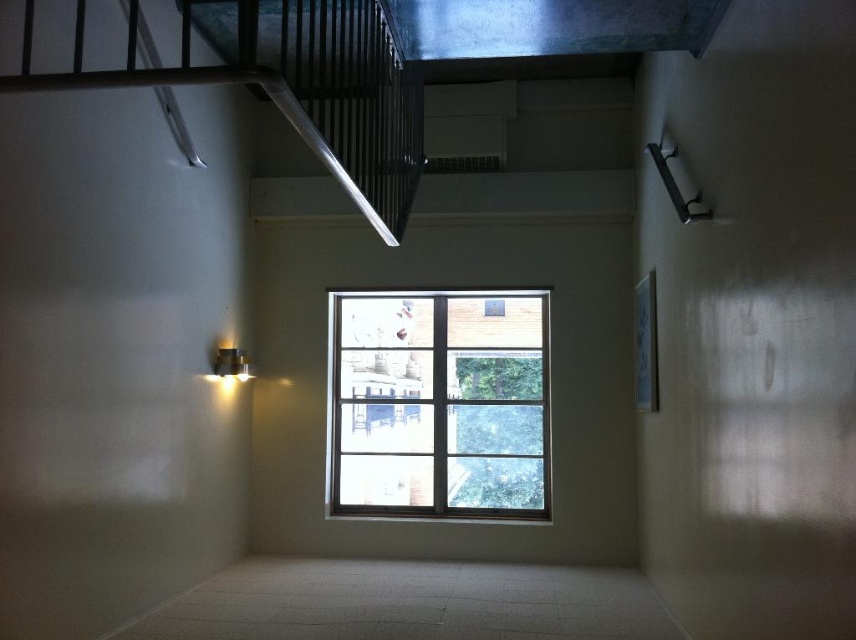
You are an interior designer planning to install a new piece of furniture in the room. You have a choice between placing a large sofa in front of the clear glass window at center or near the metallic silver stair at upper left. Based on the space each occupies, which location would you choose for the sofa to ensure it fits better?

The metallic silver stair at upper left occupies more space than the clear glass window at center, so placing the sofa near the metallic silver stair at upper left would provide more space for the sofa to fit better.

You are standing in the room and want to locate the metallic silver stair at upper left. According to the coordinates provided, where should you look?

You should look at point (327, 88) to locate the metallic silver stair at upper left.

You are standing in the room and want to turn on the matte silver light fixture at left. Can you reach it without moving the clear glass window at center?

The matte silver light fixture at left is behind the clear glass window at center, so you can reach it without moving the window because it is positioned behind the window and accessible from the room side.